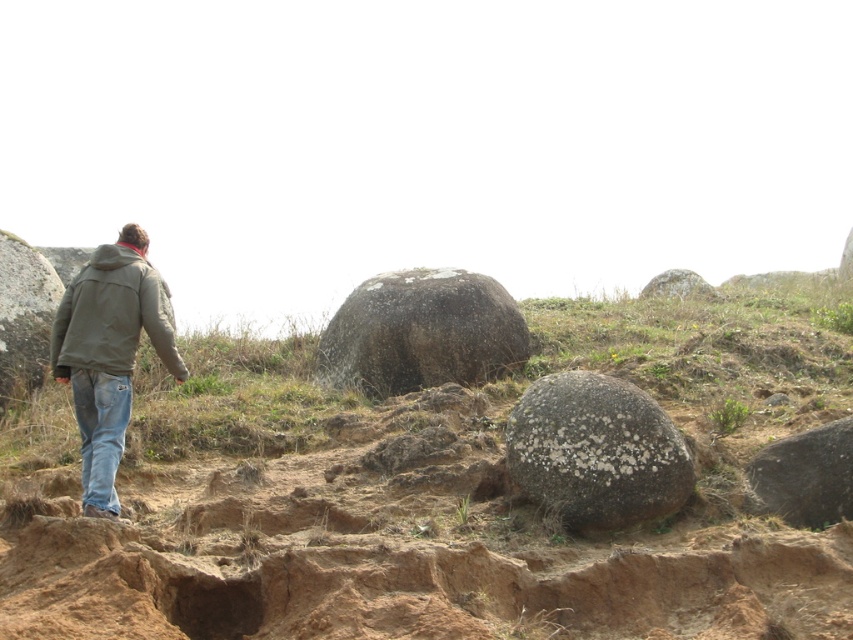
You are standing in the outdoor scene and want to pick up the denim jacket at left and the jeans at lower left. Which item should you move towards first if you are currently facing the direction the person is walking?

The denim jacket at left is positioned on the right side of jeans at lower left. Since you are facing the direction the person is walking, you should move towards the jeans at lower left first because they are to the left of the denim jacket.

You are standing at the center of the scene and want to pick up the closest rock. Which rock should you choose between the speckled gray rock at lower right and the gray speckled rock at upper right?

The speckled gray rock at lower right is smaller than the gray speckled rock at upper right, but the question asks about proximity. Since the description only mentions size and not distance, the answer cannot be determined from the given information.